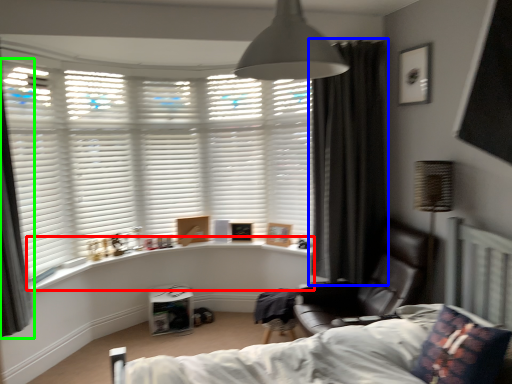
Question: Which is farther away from window sill (highlighted by a red box)? curtain (highlighted by a blue box) or curtain (highlighted by a green box)?

Choices:
 (A) curtain
 (B) curtain

Answer: (A)